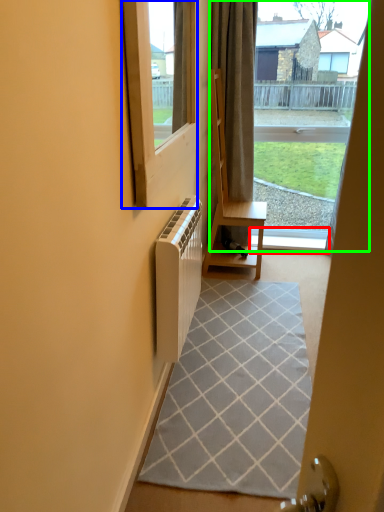
Question: Which is nearer to the window sill (highlighted by a red box)? window (highlighted by a blue box) or bay window (highlighted by a green box).

Choices:
 (A) window
 (B) bay window

Answer: (B)